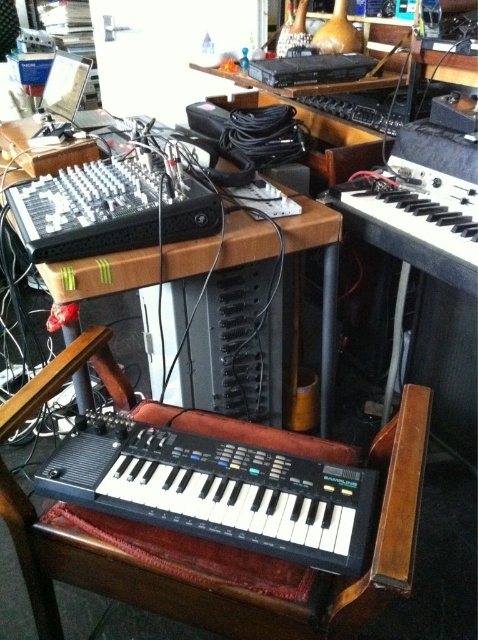
Question: Can you confirm if black plastic keyboard at lower center is wider than wooden table at center?

Choices:
 (A) yes
 (B) no

Answer: (B)

Question: Which is farther from the wooden table at center?

Choices:
 (A) black plastic keyboard at right
 (B) black plastic keyboard at lower center

Answer: (B)

Question: Is wooden table at center below black plastic keyboard at right?

Choices:
 (A) yes
 (B) no

Answer: (A)

Question: Does black plastic keyboard at lower center appear on the left side of black plastic keyboard at right?

Choices:
 (A) yes
 (B) no

Answer: (A)

Question: Which of the following is the farthest from the observer?

Choices:
 (A) (144, 264)
 (B) (57, 483)
 (C) (344, 204)

Answer: (C)

Question: Considering the real-world distances, which object is closest to the black plastic keyboard at lower center?

Choices:
 (A) black plastic keyboard at right
 (B) wooden table at center

Answer: (B)